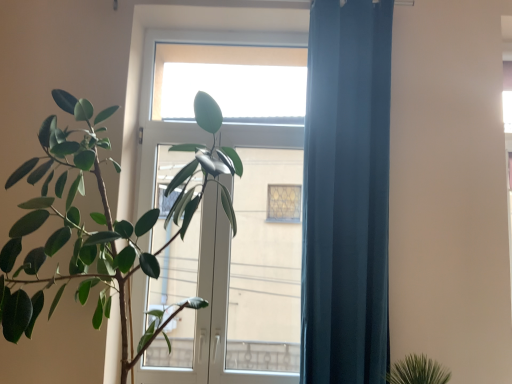
What is the approximate height of transparent glass window at upper center?

It is 21.10 inches.

The width and height of the screenshot is (512, 384). Find the location of `green matte plant at left`. green matte plant at left is located at coordinates (103, 224).

Locate an element on the screen. This screenshot has height=384, width=512. transparent glass window at upper center is located at coordinates (231, 82).

Is transparent glass screen door at center taller than transparent glass window at upper center?

Indeed, transparent glass screen door at center has a greater height compared to transparent glass window at upper center.

Is transparent glass screen door at center not near transparent glass window at upper center?

Absolutely, transparent glass screen door at center is distant from transparent glass window at upper center.

From a real-world perspective, relative to transparent glass window at upper center, is transparent glass screen door at center vertically above or below?

In terms of real-world spatial position, transparent glass screen door at center is below transparent glass window at upper center.

Is transparent glass window at upper center inside transparent glass screen door at center?

Yes, transparent glass window at upper center is surrounded by transparent glass screen door at center.

Which of these two, dark blue fabric curtain at right or green matte plant at left, is smaller?

dark blue fabric curtain at right is smaller.

From the image's perspective, which is below, dark blue fabric curtain at right or green matte plant at left?

green matte plant at left.

Considering the positions of point (312, 97) and point (202, 156), is point (312, 97) closer or farther from the camera than point (202, 156)?

Point (312, 97) appears to be farther away from the viewer than point (202, 156).

Who is shorter, dark blue fabric curtain at right or green matte plant at left?

With less height is green matte plant at left.

Which object is further away from the camera, transparent glass window at upper center or transparent glass screen door at center?

transparent glass window at upper center.

Looking at this image, between transparent glass window at upper center and transparent glass screen door at center, which one has larger size?

With larger size is transparent glass screen door at center.

Between transparent glass window at upper center and transparent glass screen door at center, which one appears on the left side from the viewer's perspective?

transparent glass window at upper center.

Considering the sizes of objects green matte plant at left and dark blue fabric curtain at right in the image provided, who is shorter, green matte plant at left or dark blue fabric curtain at right?

green matte plant at left is shorter.

Which is behind, point (105, 306) or point (315, 220)?

Point (105, 306)

Is green matte plant at left smaller than dark blue fabric curtain at right?

Incorrect, green matte plant at left is not smaller in size than dark blue fabric curtain at right.

Which point is more forward, (165, 258) or (23, 228)?

The point (23, 228) is more forward.

Is transparent glass screen door at center inside or outside of green matte plant at left?

transparent glass screen door at center is located beyond the bounds of green matte plant at left.

Is transparent glass screen door at center aimed at green matte plant at left?

Yes, transparent glass screen door at center faces towards green matte plant at left.

Considering the sizes of transparent glass window at upper center and dark blue fabric curtain at right in the image, is transparent glass window at upper center wider or thinner than dark blue fabric curtain at right?

Clearly, transparent glass window at upper center has less width compared to dark blue fabric curtain at right.

Is transparent glass window at upper center in front of dark blue fabric curtain at right?

That is False.

Considering the points (217, 90) and (386, 92), which point is behind, point (217, 90) or point (386, 92)?

The point (217, 90) is farther.

Is dark blue fabric curtain at right far away from transparent glass window at upper center?

That's not correct — dark blue fabric curtain at right is a little close to transparent glass window at upper center.

Consider the image. Considering the relative sizes of dark blue fabric curtain at right and transparent glass window at upper center in the image provided, is dark blue fabric curtain at right shorter than transparent glass window at upper center?

No, dark blue fabric curtain at right is not shorter than transparent glass window at upper center.

Considering the positions of point (366, 133) and point (191, 97), is point (366, 133) closer or farther from the camera than point (191, 97)?

Point (366, 133) is closer to the camera than point (191, 97).

Which of these two, dark blue fabric curtain at right or transparent glass window at upper center, is bigger?

Bigger between the two is dark blue fabric curtain at right.

Where is `window positioned vertically above the transparent glass screen door at center (from a real-world perspective)`? The height and width of the screenshot is (384, 512). window positioned vertically above the transparent glass screen door at center (from a real-world perspective) is located at coordinates (231, 82).

In the image, there is a dark blue fabric curtain at right. Find the location of `houseplant below it (from the image's perspective)`. houseplant below it (from the image's perspective) is located at coordinates (103, 224).

Considering their positions, is green matte plant at left positioned closer to dark blue fabric curtain at right than transparent glass window at upper center?

green matte plant at left is closer to dark blue fabric curtain at right.

Looking at this image, when comparing their distances from dark blue fabric curtain at right, does green matte plant at left or transparent glass screen door at center seem closer?

green matte plant at left.

In the scene shown: Considering their positions, is dark blue fabric curtain at right positioned closer to transparent glass window at upper center than green matte plant at left?

dark blue fabric curtain at right.

Estimate the real-world distances between objects in this image. Which object is closer to green matte plant at left, transparent glass window at upper center or transparent glass screen door at center?

Among the two, transparent glass window at upper center is located nearer to green matte plant at left.

From the image, which object appears to be nearer to dark blue fabric curtain at right, transparent glass screen door at center or green matte plant at left?

Among the two, green matte plant at left is located nearer to dark blue fabric curtain at right.

Estimate the real-world distances between objects in this image. Which object is closer to transparent glass window at upper center, transparent glass screen door at center or green matte plant at left?

green matte plant at left is closer to transparent glass window at upper center.

Considering their positions, is transparent glass window at upper center positioned further to dark blue fabric curtain at right than green matte plant at left?

transparent glass window at upper center is further to dark blue fabric curtain at right.

Which object lies further to the anchor point green matte plant at left, transparent glass screen door at center or dark blue fabric curtain at right?

transparent glass screen door at center.

Where is `window between green matte plant at left and dark blue fabric curtain at right from left to right`? The image size is (512, 384). window between green matte plant at left and dark blue fabric curtain at right from left to right is located at coordinates (231, 82).

Find the location of `screen door located between green matte plant at left and dark blue fabric curtain at right in the left-right direction`. screen door located between green matte plant at left and dark blue fabric curtain at right in the left-right direction is located at coordinates (237, 280).

You are a GUI agent. You are given a task and a screenshot of the screen. Output one action in this format:
    pyautogui.click(x=<x>, y=<y>)
    Task: Click on the curtain between transparent glass window at upper center and transparent glass screen door at center in the up-down direction
    The image size is (512, 384).
    Given the screenshot: What is the action you would take?
    pyautogui.click(x=346, y=194)

Locate an element on the screen. screen door located between green matte plant at left and transparent glass window at upper center in the depth direction is located at coordinates (237, 280).